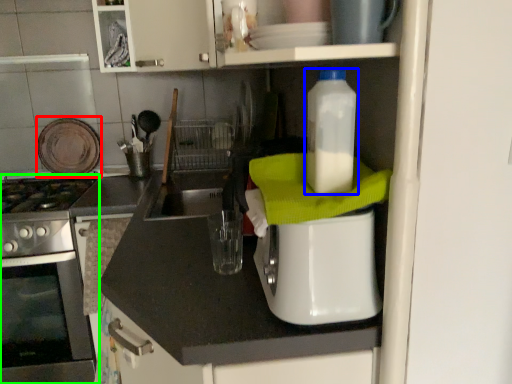
Question: Which object is the farthest from appliance (highlighted by a red box)? Choose among these: bottle (highlighted by a blue box) or home appliance (highlighted by a green box).

Choices:
 (A) bottle
 (B) home appliance

Answer: (A)